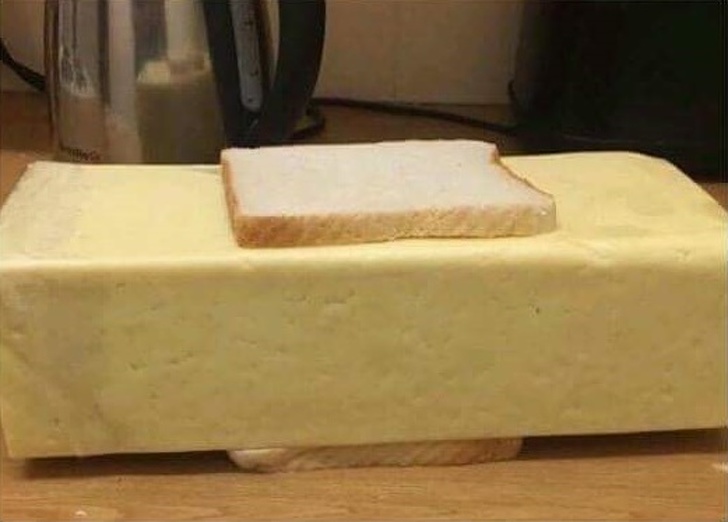
The width and height of the screenshot is (728, 522). What are the coordinates of `candle` in the screenshot? It's located at (174, 72).